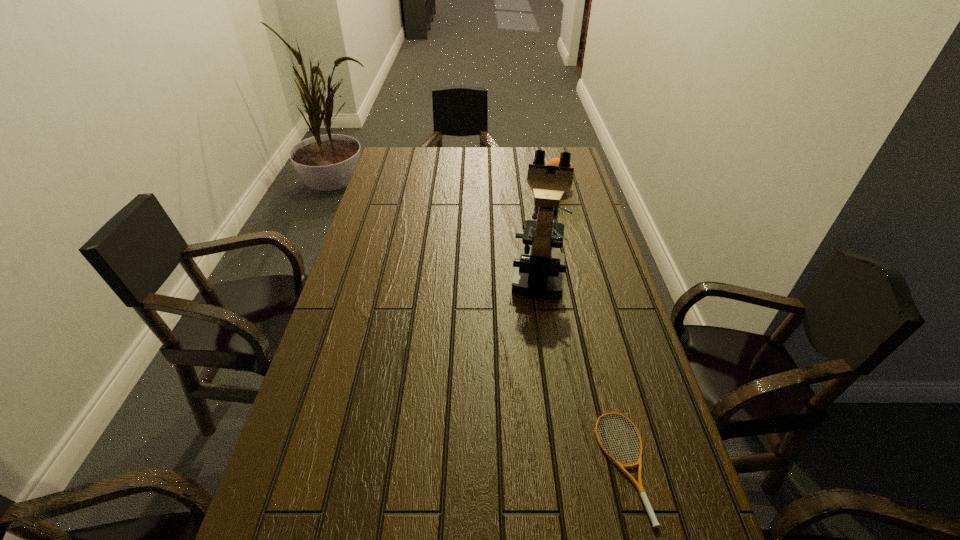
Where is `the tallest object`? This screenshot has height=540, width=960. the tallest object is located at coordinates (539, 271).

Identify the location of the second nearest object. (539, 271).

Image resolution: width=960 pixels, height=540 pixels. Identify the location of the second tallest object. (555, 161).

Locate an element on the screen. the farthest object is located at coordinates (555, 161).

You are a GUI agent. You are given a task and a screenshot of the screen. Output one action in this format:
    pyautogui.click(x=<x>, y=<y>)
    Task: Click on the shortest object
    
    Given the screenshot: What is the action you would take?
    pyautogui.click(x=655, y=523)

Identify the location of tennis racket. (655, 523).

This screenshot has height=540, width=960. I want to click on free space located 0.260m on the front of the second farthest object, so click(553, 376).

The image size is (960, 540). In order to click on free space located on the left of the farthest object in this screenshot , I will do `click(526, 186)`.

The width and height of the screenshot is (960, 540). Identify the location of blank space located on the right of the shortest object. (683, 466).

The width and height of the screenshot is (960, 540). Find the location of `microscope that is at the right edge`. microscope that is at the right edge is located at coordinates (539, 271).